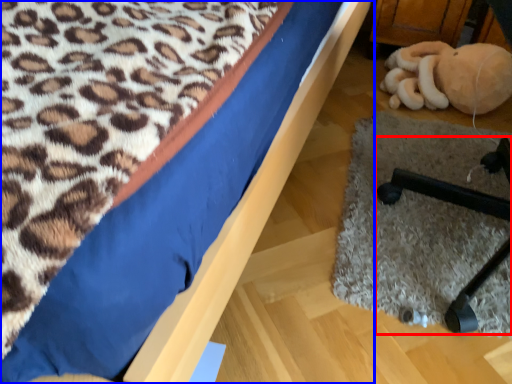
Question: Which point is closer to the camera, furniture (highlighted by a red box) or bed (highlighted by a blue box)?

Choices:
 (A) furniture
 (B) bed

Answer: (B)